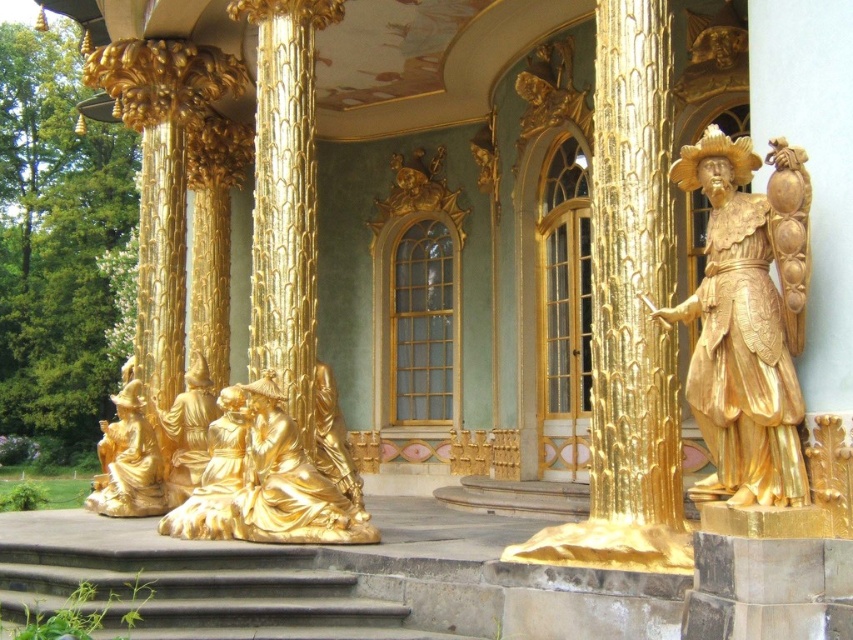
Question: Does gold polished statue at lower left have a larger size compared to gold/gilded statue at lower center?

Choices:
 (A) no
 (B) yes

Answer: (A)

Question: Observing the image, what is the correct spatial positioning of gold/gilded statue at lower left in reference to gold/gilded statue at lower center?

Choices:
 (A) right
 (B) left

Answer: (B)

Question: Which point is farther to the camera?

Choices:
 (A) (779, 324)
 (B) (131, 465)
 (C) (207, 456)
 (D) (195, 492)

Answer: (C)

Question: Does gold/gilded statue at lower left have a smaller size compared to gold textured statue at lower left?

Choices:
 (A) no
 (B) yes

Answer: (A)

Question: Which point appears farthest from the camera in this image?

Choices:
 (A) (723, 445)
 (B) (274, 499)
 (C) (175, 444)

Answer: (C)

Question: Among these objects, which one is farthest from the camera?

Choices:
 (A) gold polished statue at lower center
 (B) gold textured statue at lower left
 (C) gold polished statue at lower left
 (D) gold/gilded statue at lower left

Answer: (B)